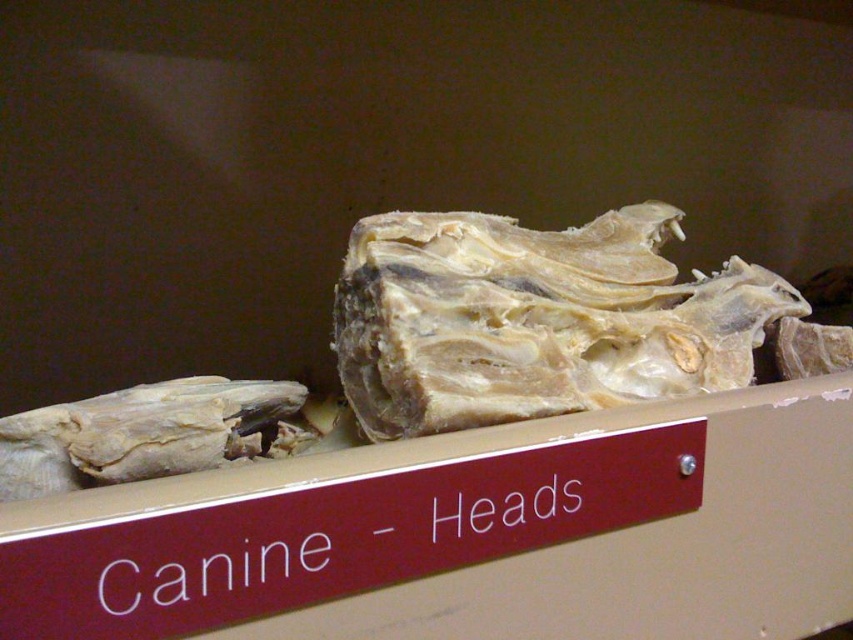
You are an assistant organizing a museum exhibit and need to place a new label for the white cardboard box at center. According to the display case layout, where should you position the new label relative to the box?

The white cardboard box at center is located at point (x=477, y=532), so the new label should be placed at that coordinate to ensure proper alignment with the box.

You are a museum curator organizing an exhibit. You need to place a new item between the white cardboard box at center and the white fibrous bone at center. Which object should you place it closer to if you want it to be on the right side of the existing arrangement?

You should place the new item closer to the white cardboard box at center because the white cardboard box at center is to the left of the white fibrous bone at center. This way, placing it to the right of the box but left of the bone would position it on the right side of the existing arrangement.

You are a museum curator preparing to move the white cardboard box at center and the white fibrous bone at center into a storage container. The container has a width of 1 meter. Based on their sizes, will both items fit side by side within the container?

The white cardboard box at center might be wider than white fibrous bone at center, so there is uncertainty about whether both items will fit side by side in the 1 meter wide container without exceeding its width. Further measurement is needed to confirm.